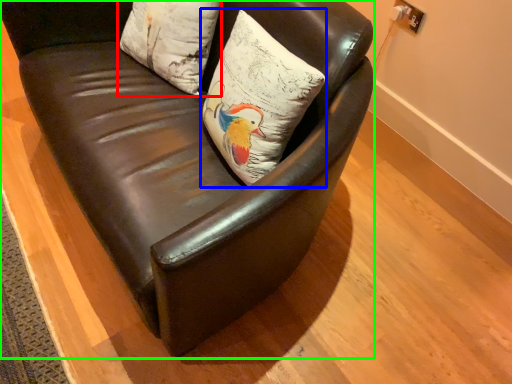
Question: Considering the real-world distances, which object is closest to pillow (highlighted by a red box)? pillow (highlighted by a blue box) or chair (highlighted by a green box).

Choices:
 (A) pillow
 (B) chair

Answer: (B)